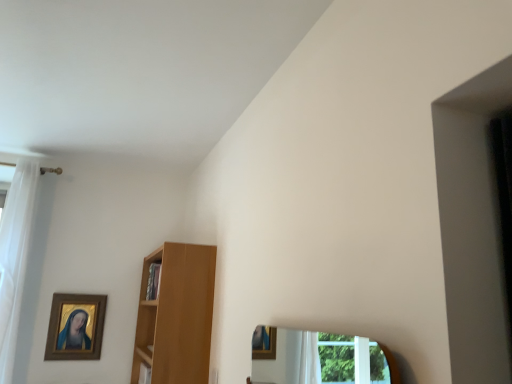
Question: Considering the positions of white sheer curtain at left and wooden cabinet at center in the image, is white sheer curtain at left taller or shorter than wooden cabinet at center?

Choices:
 (A) short
 (B) tall

Answer: (B)

Question: From a real-world perspective, is white sheer curtain at left above or below wooden cabinet at center?

Choices:
 (A) below
 (B) above

Answer: (B)

Question: Which of these objects is positioned farthest from the white sheer curtain at left?

Choices:
 (A) gold-framed painting at upper left
 (B) wooden cabinet at center
 (C) light brown wooden shelf at center

Answer: (C)

Question: Based on their relative distances, which object is farther from the gold-framed painting at upper left?

Choices:
 (A) white sheer curtain at left
 (B) wooden cabinet at center
 (C) light brown wooden shelf at center

Answer: (C)